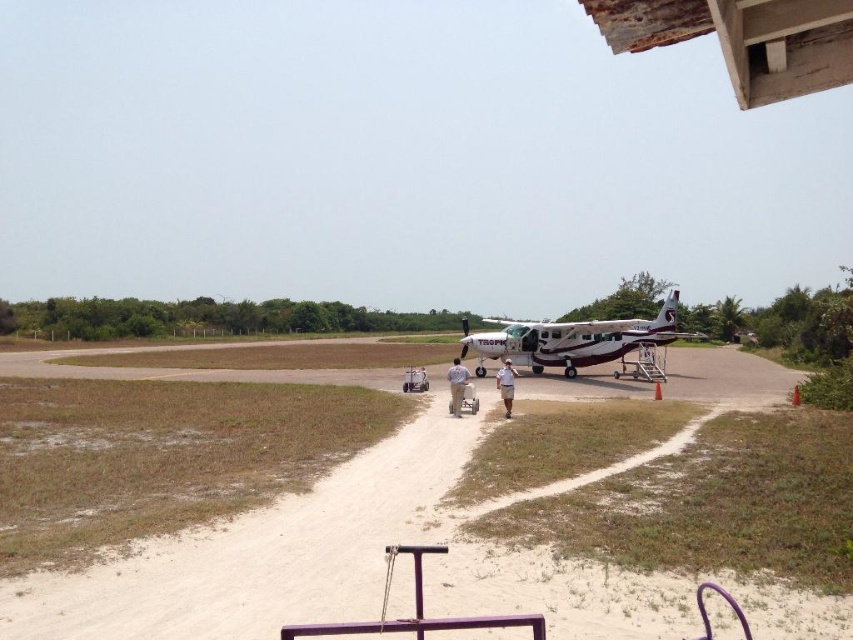
Can you confirm if brown sandy dirt track at lower left is smaller than white matte airplane at center?

Indeed, brown sandy dirt track at lower left has a smaller size compared to white matte airplane at center.

Is point (51, 600) positioned after point (613, 353)?

No, (51, 600) is closer to viewer.

The width and height of the screenshot is (853, 640). What are the coordinates of `brown sandy dirt track at lower left` in the screenshot? It's located at (259, 554).

What are the coordinates of `brown sandy dirt track at lower left` in the screenshot? It's located at (259, 554).

Which is more to the right, white matte airplane at center or tan fabric shorts at center?

white matte airplane at center is more to the right.

Locate an element on the screen. The height and width of the screenshot is (640, 853). white matte airplane at center is located at coordinates (573, 339).

Is point (506, 323) farther from viewer compared to point (453, 369)?

Yes, point (506, 323) is farther from viewer.

This screenshot has width=853, height=640. I want to click on white matte airplane at center, so click(573, 339).

Who is more forward, (625, 342) or (495, 380)?

Point (495, 380)

Can you confirm if white matte airplane at center is taller than khaki cotton shirt at center?

Correct, white matte airplane at center is much taller as khaki cotton shirt at center.

Is point (624, 342) farther from camera compared to point (509, 410)?

Yes, it is behind point (509, 410).

At what (x,y) coordinates should I click in order to perform the action: click on white matte airplane at center. Please return your answer as a coordinate pair (x, y). The width and height of the screenshot is (853, 640). Looking at the image, I should click on (573, 339).